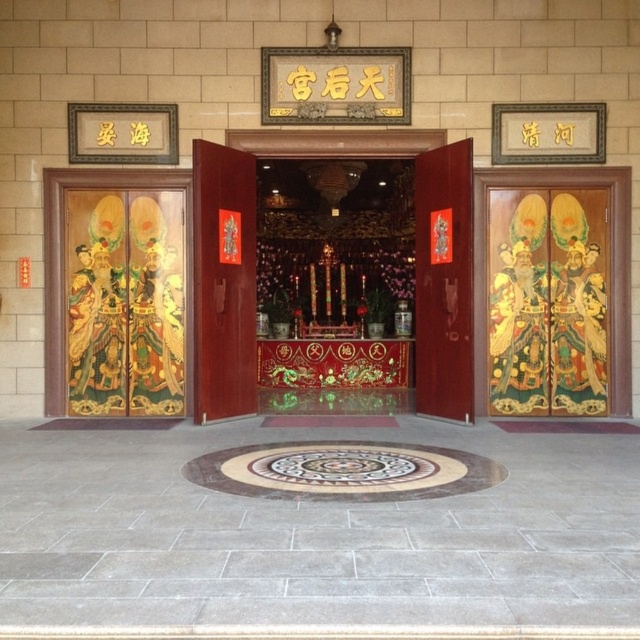
Who is higher up, matte wooden door at center or matte wood door at center?

matte wood door at center is higher up.

In order to click on matte wooden door at center in this screenshot , I will do `click(224, 282)`.

Can you confirm if polished wood doors at center is positioned above matte wood door at center?

Yes, polished wood doors at center is above matte wood door at center.

Is polished wood doors at center positioned at the back of matte wood door at center?

Yes, polished wood doors at center is behind matte wood door at center.

Is point (456, 156) closer to camera compared to point (428, 305)?

Yes, point (456, 156) is closer to viewer.

Where is `polished wood doors at center`? The width and height of the screenshot is (640, 640). polished wood doors at center is located at coordinates (349, 157).

Consider the image. Is polished wood doors at center further to the viewer compared to matte wooden door at center?

That is False.

Which is more to the left, polished wood doors at center or matte wooden door at center?

From the viewer's perspective, matte wooden door at center appears more on the left side.

This screenshot has width=640, height=640. Describe the element at coordinates (349, 157) in the screenshot. I see `polished wood doors at center` at that location.

Where is `polished wood doors at center`? This screenshot has width=640, height=640. polished wood doors at center is located at coordinates (349, 157).